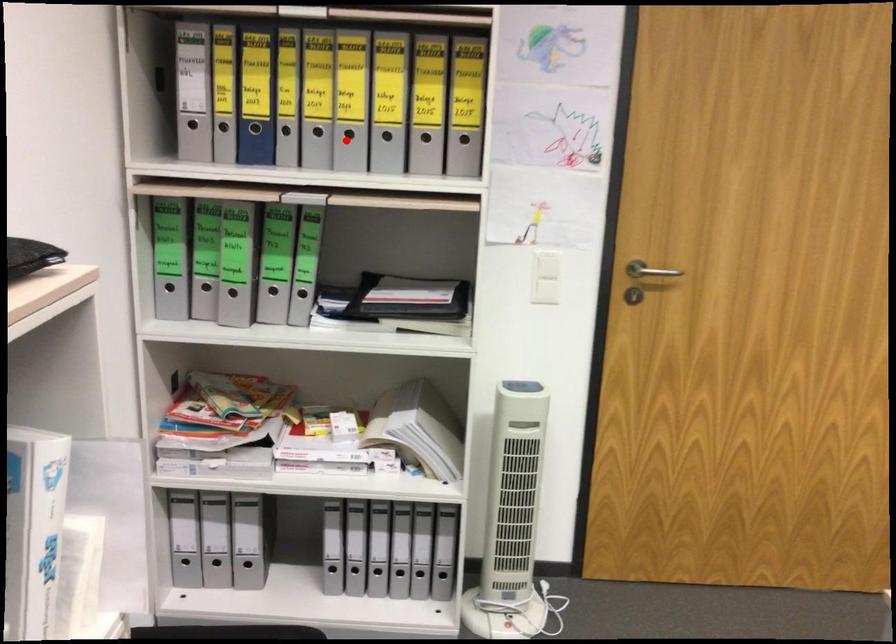
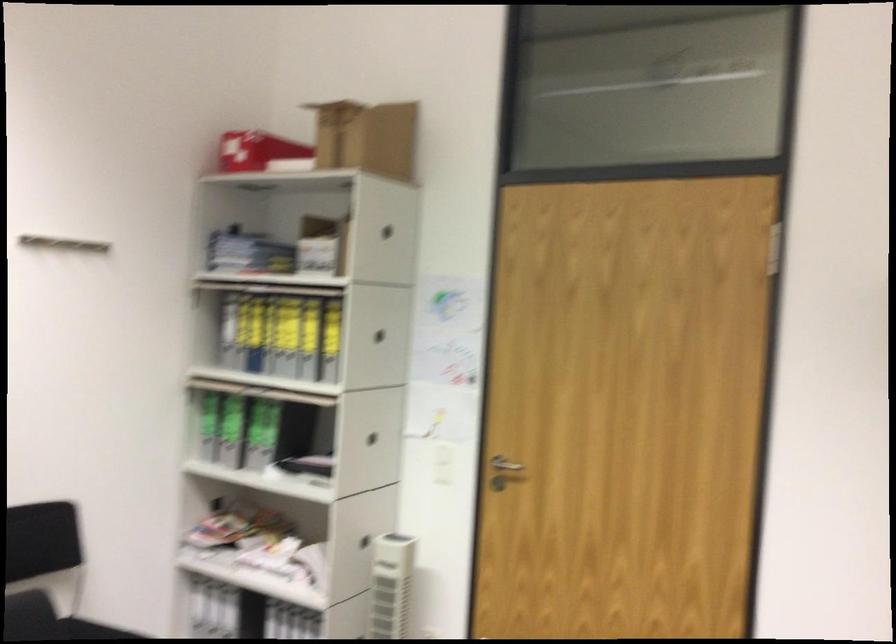
Question: I am providing you with two images of the same scene from different viewpoints. In image1, a red point is highlighted. Considering the same 3D point in image2, which of the following is correct?

Choices:
 (A) It is closer
 (B) It is farther

Answer: (B)